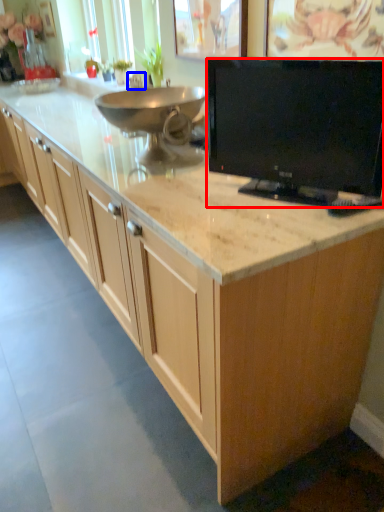
Question: Among these objects, which one is nearest to the camera, television (highlighted by a red box) or faucet (highlighted by a blue box)?

Choices:
 (A) television
 (B) faucet

Answer: (A)